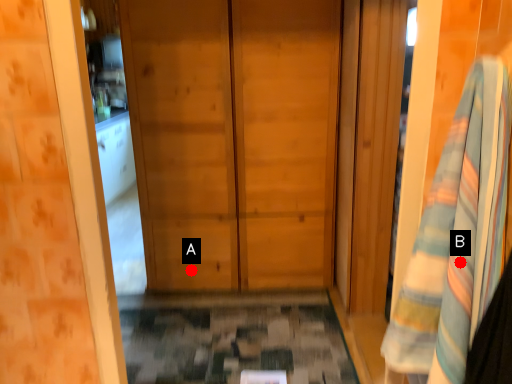
Question: Two points are circled on the image, labeled by A and B beside each circle. Which point is farther from the camera taking this photo?

Choices:
 (A) A is further
 (B) B is further

Answer: (A)